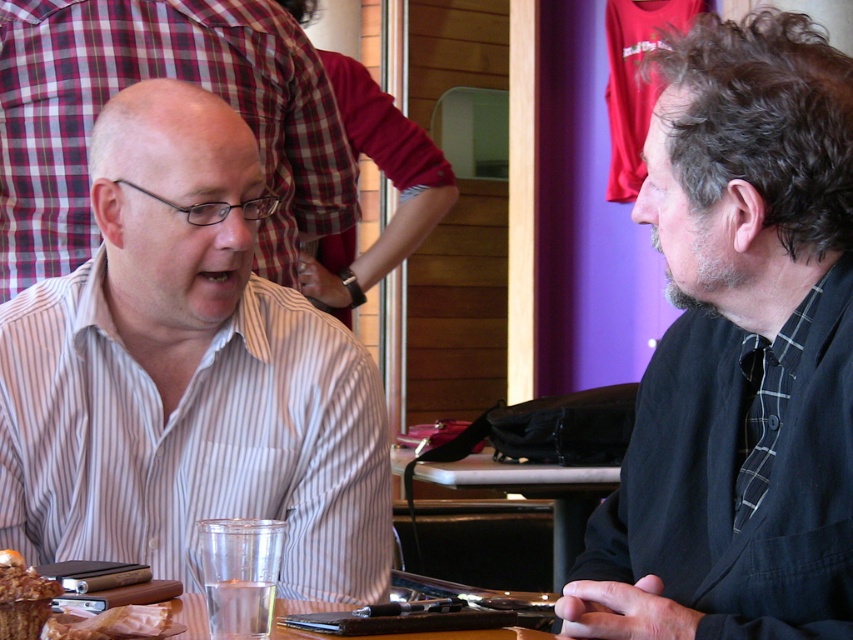
Based on the photo, you are a photographer trying to capture a closeup of the golden brown bread at lower left without the dark gray flannel shirt at right blocking the view. Is this possible given their positions?

The dark gray flannel shirt at right is closer to the viewer than the golden brown bread at lower left, so it would block the view of the bread. Therefore, capturing a closeup of the golden brown bread at lower left without the shirt blocking the view is not possible.

You are a chef who needs to place a chocolate cake at lower left onto the wooden table at center. Can you do this without needing to adjust the height of either object?

The wooden table at center is much taller than the chocolate cake at lower left, so the chef can place the chocolate cake at lower left onto the wooden table at center without needing to adjust their height.

You are a photographer setting up for a portrait. You need to ensure that the dark gray flannel shirt at right and the wooden table at center are both in focus. Since depth of field can be limited, which object should you focus on to ensure both are sharp?

The wooden table at center should be the focus point because the dark gray flannel shirt at right is located above it, so focusing on the table will keep both in the depth of field.